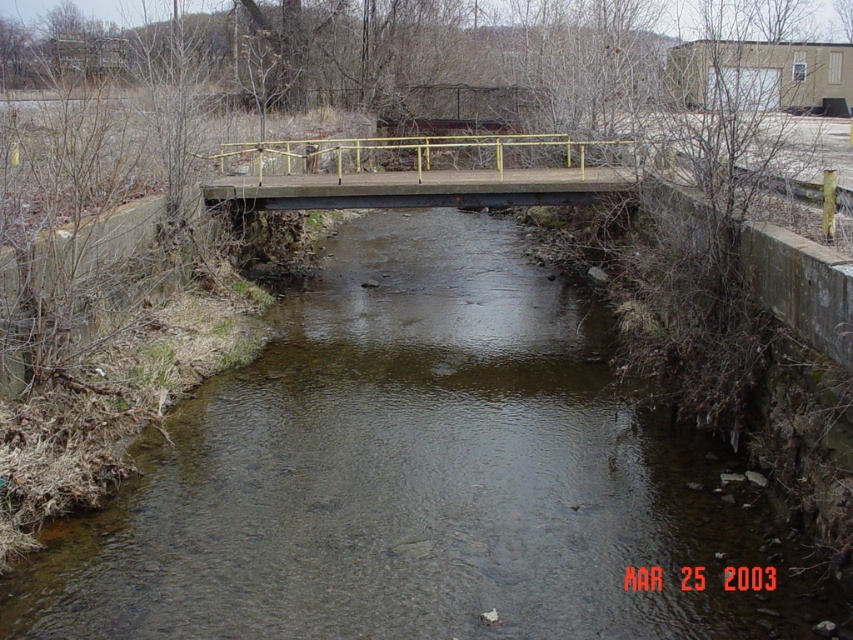
Is point (206, 484) more distant than point (560, 150)?

No, it is not.

Does clear water at center have a lesser height compared to matte concrete bridge at center?

Yes, clear water at center is shorter than matte concrete bridge at center.

Is point (605, 612) closer to camera compared to point (408, 186)?

Yes, it is in front of point (408, 186).

The height and width of the screenshot is (640, 853). Find the location of `clear water at center`. clear water at center is located at coordinates (415, 476).